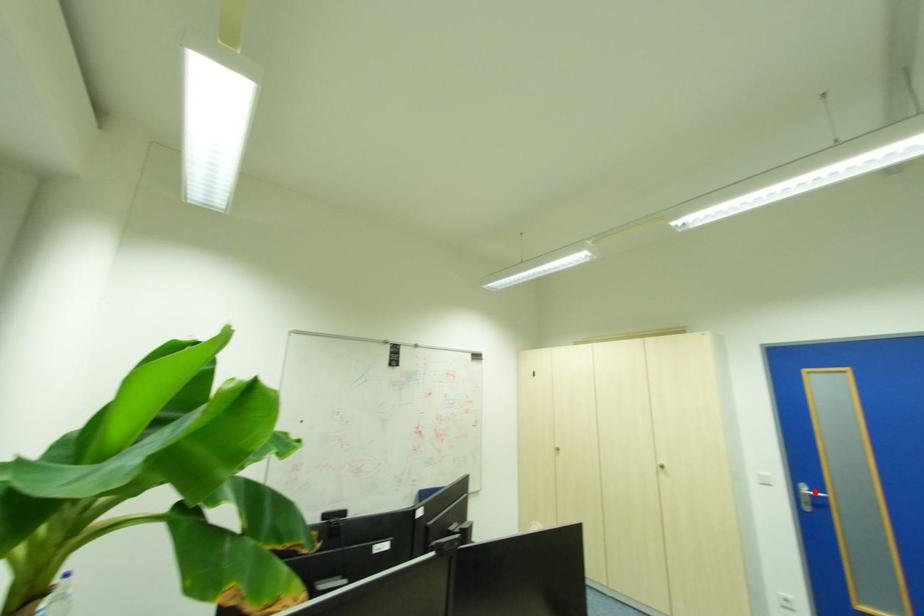
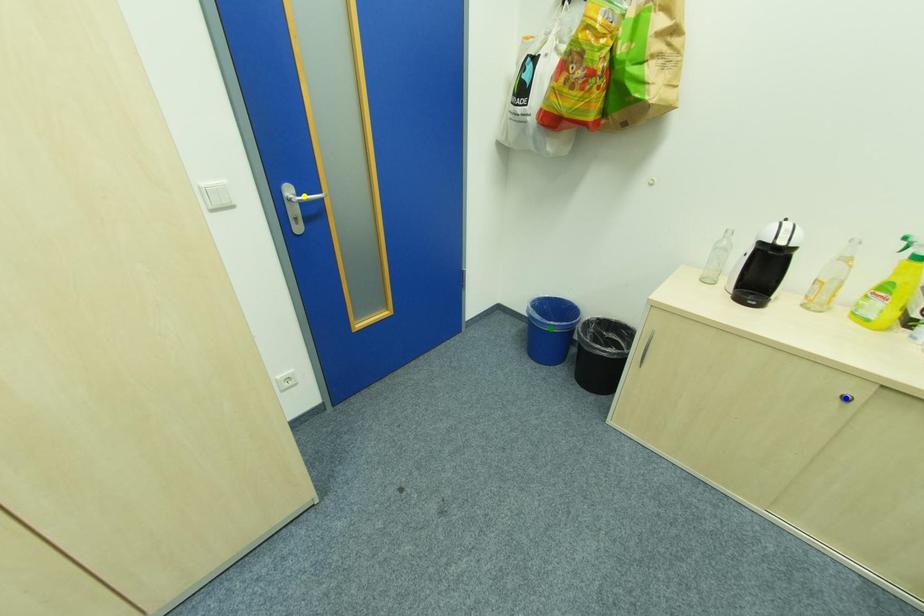
Question: I am providing you with two images of the same scene from different viewpoints. A red point is marked on the first image. You are given multiple points on the second image. Which point in image 2 is actually the same real-world point as the red point in image 1?

Choices:
 (A) yellow point
 (B) blue point
 (C) green point

Answer: (A)